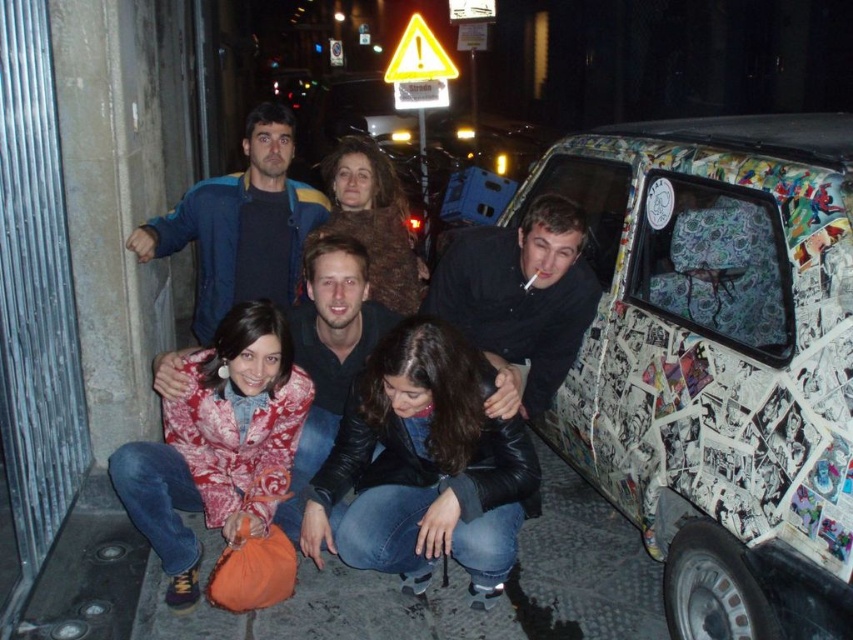
Question: Which of the following is the farthest from the observer?

Choices:
 (A) (277, 410)
 (B) (822, 186)

Answer: (A)

Question: Among these objects, which one is farthest from the camera?

Choices:
 (A) leather jacket at center
 (B) printed fabric jacket at lower left

Answer: (B)

Question: Among these objects, which one is farthest from the camera?

Choices:
 (A) white comic book pages van at right
 (B) printed fabric jacket at lower left
 (C) leather jacket at center

Answer: (B)

Question: Is white comic book pages van at right thinner than leather jacket at center?

Choices:
 (A) no
 (B) yes

Answer: (A)

Question: Is white comic book pages van at right above printed fabric jacket at lower left?

Choices:
 (A) yes
 (B) no

Answer: (A)

Question: Can you confirm if white comic book pages van at right is positioned to the left of printed fabric jacket at lower left?

Choices:
 (A) yes
 (B) no

Answer: (B)